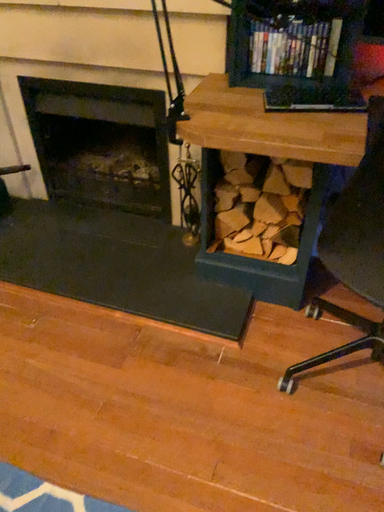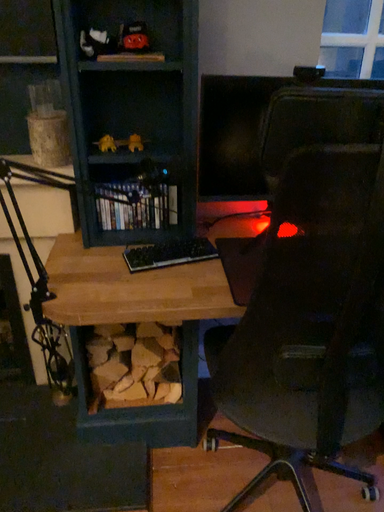
Question: How did the camera likely rotate when shooting the video?

Choices:
 (A) rotated right
 (B) rotated left

Answer: (A)